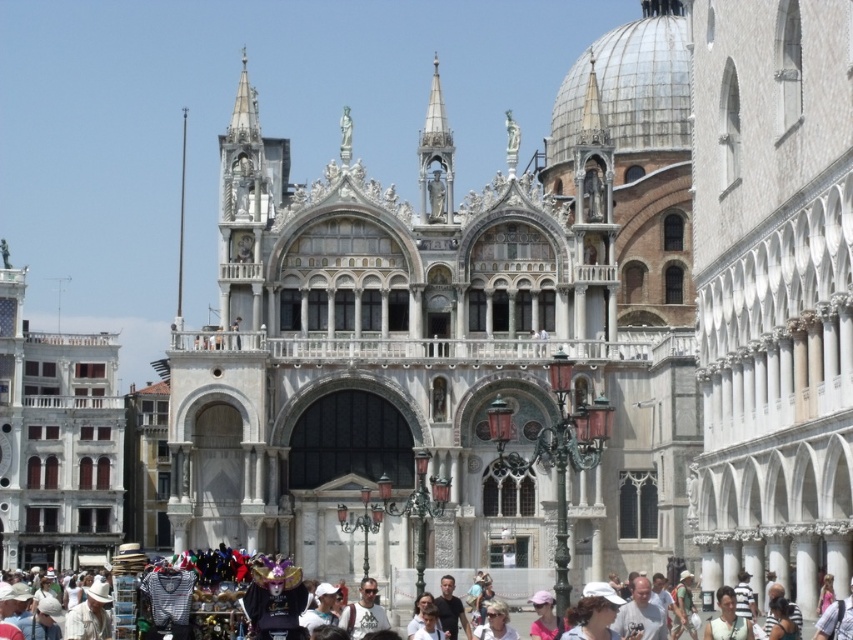
Who is positioned more to the left, white marble palace at center or white cotton hats at lower center?

white cotton hats at lower center is more to the left.

Measure the distance between white marble palace at center and camera.

white marble palace at center and camera are 67.68 meters apart.

Who is more distant from viewer, (x=288, y=321) or (x=225, y=612)?

Positioned behind is point (x=288, y=321).

Locate an element on the screen. This screenshot has height=640, width=853. white marble palace at center is located at coordinates (453, 333).

Is white marble building at left to the left of white cotton hats at lower center from the viewer's perspective?

Correct, you'll find white marble building at left to the left of white cotton hats at lower center.

Looking at this image, which is more to the left, white marble building at left or white cotton hats at lower center?

Positioned to the left is white marble building at left.

Does point (10, 381) come in front of point (136, 634)?

No, (10, 381) is further to viewer.

Locate an element on the screen. white marble building at left is located at coordinates (56, 440).

Who is higher up, white marble palace at center or white marble building at left?

Positioned higher is white marble palace at center.

Does white marble palace at center appear under white marble building at left?

Incorrect, white marble palace at center is not positioned below white marble building at left.

The width and height of the screenshot is (853, 640). Describe the element at coordinates (453, 333) in the screenshot. I see `white marble palace at center` at that location.

Image resolution: width=853 pixels, height=640 pixels. I want to click on white marble palace at center, so click(453, 333).